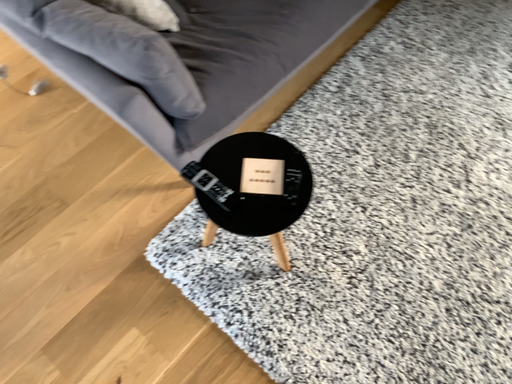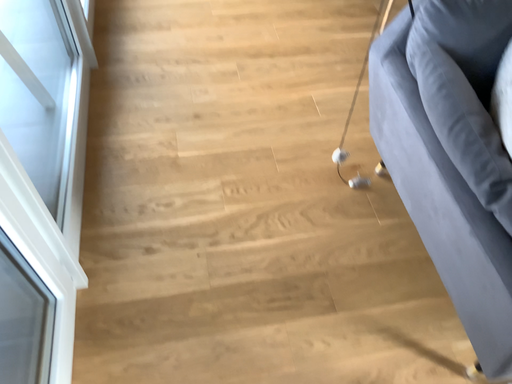
Question: How did the camera likely rotate when shooting the video?

Choices:
 (A) rotated downward
 (B) rotated upward

Answer: (B)